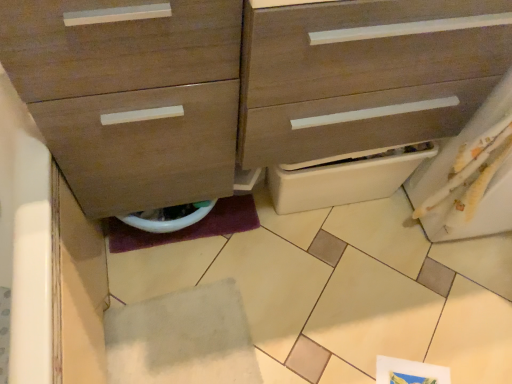
Question: From the image's perspective, is white felt tile at lower center above matte wood chest of drawers at center?

Choices:
 (A) no
 (B) yes

Answer: (A)

Question: Would you say white felt tile at lower center is outside matte wood chest of drawers at center?

Choices:
 (A) no
 (B) yes

Answer: (B)

Question: From the image's perspective, is white felt tile at lower center beneath matte wood chest of drawers at center?

Choices:
 (A) yes
 (B) no

Answer: (A)

Question: Considering the relative sizes of white felt tile at lower center and matte wood chest of drawers at center in the image provided, is white felt tile at lower center thinner than matte wood chest of drawers at center?

Choices:
 (A) yes
 (B) no

Answer: (A)

Question: From a real-world perspective, is white felt tile at lower center beneath matte wood chest of drawers at center?

Choices:
 (A) yes
 (B) no

Answer: (A)

Question: Looking at their shapes, would you say white felt tile at lower center is wider or thinner than white glossy toilet bowl at lower center?

Choices:
 (A) thin
 (B) wide

Answer: (B)

Question: Relative to white glossy toilet bowl at lower center, is white felt tile at lower center in front or behind?

Choices:
 (A) front
 (B) behind

Answer: (A)

Question: Looking at the image, does white felt tile at lower center seem bigger or smaller compared to white glossy toilet bowl at lower center?

Choices:
 (A) big
 (B) small

Answer: (A)

Question: Is white felt tile at lower center situated inside white glossy toilet bowl at lower center or outside?

Choices:
 (A) outside
 (B) inside

Answer: (A)

Question: Is white glossy toilet bowl at lower center taller or shorter than white felt tile at lower center?

Choices:
 (A) short
 (B) tall

Answer: (B)

Question: In the image, is white glossy toilet bowl at lower center positioned in front of or behind white felt tile at lower center?

Choices:
 (A) behind
 (B) front

Answer: (A)

Question: Visually, is white glossy toilet bowl at lower center positioned to the left or to the right of white felt tile at lower center?

Choices:
 (A) left
 (B) right

Answer: (A)

Question: Looking at the image, does white glossy toilet bowl at lower center seem bigger or smaller compared to white felt tile at lower center?

Choices:
 (A) big
 (B) small

Answer: (B)

Question: In terms of height, does matte wood chest of drawers at center look taller or shorter compared to white felt tile at lower center?

Choices:
 (A) short
 (B) tall

Answer: (B)

Question: Considering the positions of matte wood chest of drawers at center and white felt tile at lower center in the image, is matte wood chest of drawers at center bigger or smaller than white felt tile at lower center?

Choices:
 (A) small
 (B) big

Answer: (B)